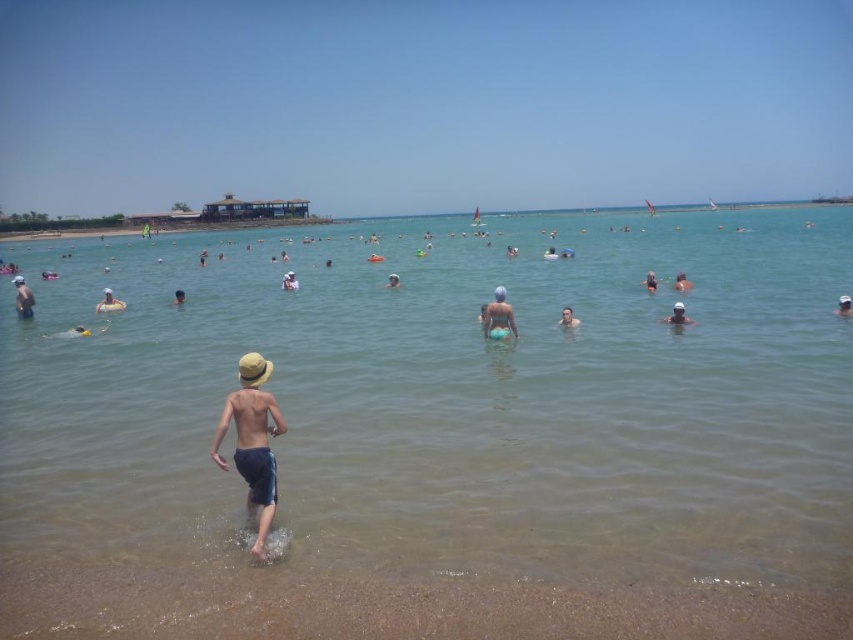
Question: Does light yellow straw hat at center lie behind dark blue swimsuit at center?

Choices:
 (A) no
 (B) yes

Answer: (A)

Question: Can you confirm if smooth skin at center is positioned above light yellow straw hat at left?

Choices:
 (A) yes
 (B) no

Answer: (B)

Question: Which point is closer to the camera?

Choices:
 (A) pyautogui.click(x=107, y=305)
 (B) pyautogui.click(x=850, y=301)
 (C) pyautogui.click(x=674, y=285)

Answer: (B)

Question: Can you confirm if clear water at center is smaller than light blue fabric swim trunks at center?

Choices:
 (A) no
 (B) yes

Answer: (A)

Question: Which point is closer to the camera taking this photo?

Choices:
 (A) (503, 307)
 (B) (105, 298)
 (C) (577, 323)

Answer: (A)

Question: Among these objects, which one is farthest from the camera?

Choices:
 (A) light blue fabric swim trunks at center
 (B) dark blue swim trunks at center
 (C) light blue fabric swimmer at center

Answer: (B)